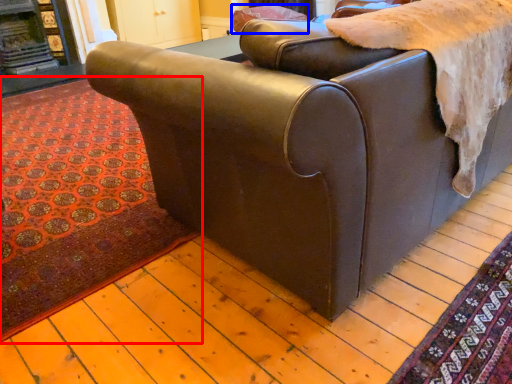
Question: Which point is further to the camera, mat (highlighted by a red box) or pillow (highlighted by a blue box)?

Choices:
 (A) mat
 (B) pillow

Answer: (B)